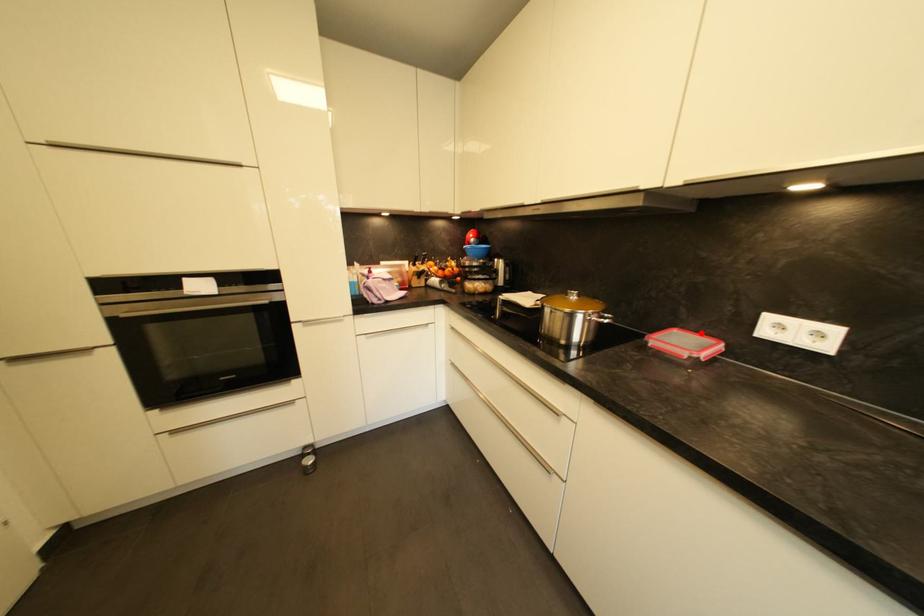
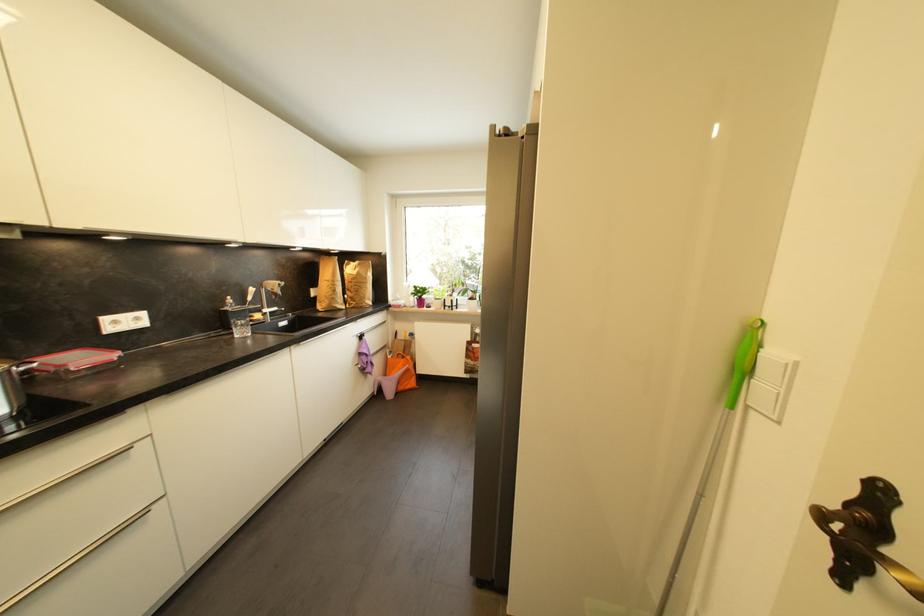
The point at the highlighted location is marked in the first image. Where is the corresponding point in the second image?

(54, 355)